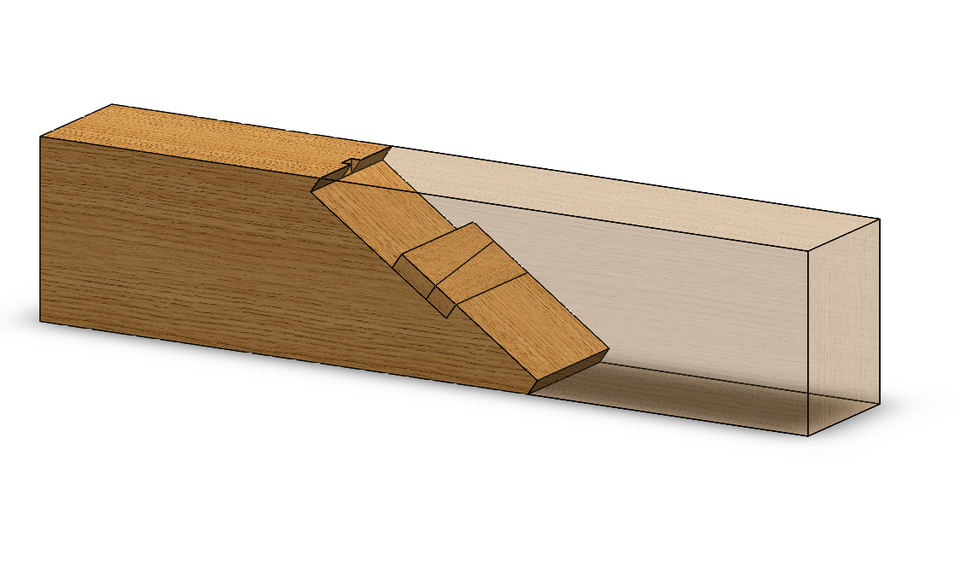
Locate an element on the screen. The image size is (960, 566). transparent box is located at coordinates (726, 291).